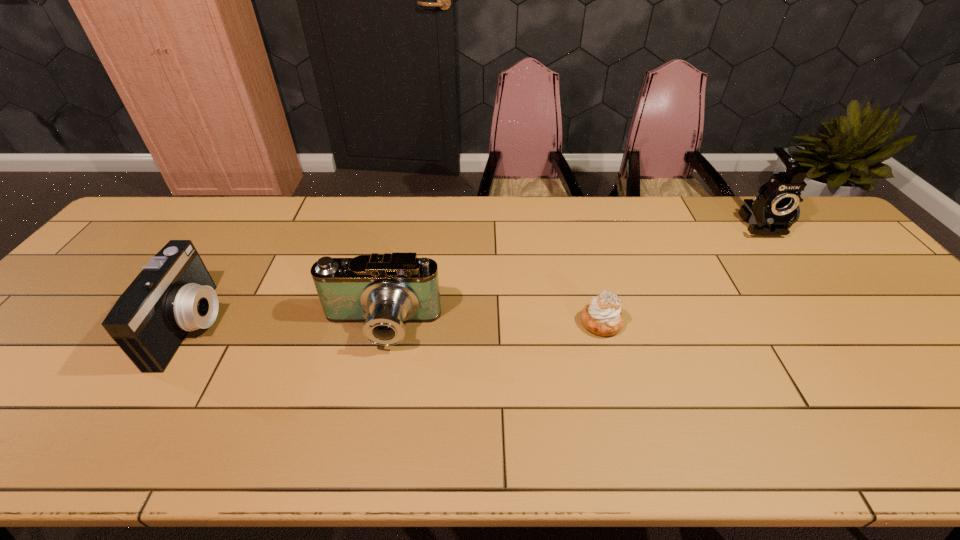
The image size is (960, 540). In order to click on object at the far edge in this screenshot , I will do `click(775, 210)`.

In order to click on object present at the right edge in this screenshot , I will do `click(775, 210)`.

What are the coordinates of `object present at the far right corner` in the screenshot? It's located at (775, 210).

In the image, there is a desktop. Where is `blank space at the far edge`? blank space at the far edge is located at coordinates (380, 200).

The height and width of the screenshot is (540, 960). In order to click on free space at the near edge of the desktop in this screenshot , I will do `click(717, 444)`.

Locate an element on the screen. The width and height of the screenshot is (960, 540). vacant space at the far left corner is located at coordinates (184, 208).

Where is `empty space that is in between the leftmost object and the third object from right to left`? Image resolution: width=960 pixels, height=540 pixels. empty space that is in between the leftmost object and the third object from right to left is located at coordinates (286, 327).

I want to click on vacant space in between the shortest object and the farthest camcorder, so click(x=681, y=272).

Where is `free space between the leftmost camcorder and the second camcorder from left to right`? free space between the leftmost camcorder and the second camcorder from left to right is located at coordinates (286, 327).

Where is `free point between the farthest object and the leftmost camcorder`? free point between the farthest object and the leftmost camcorder is located at coordinates (476, 274).